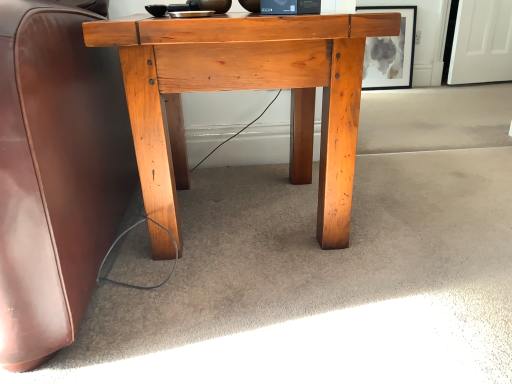
The image size is (512, 384). Identify the location of free space in front of matte black picture frame at upper center. (389, 99).